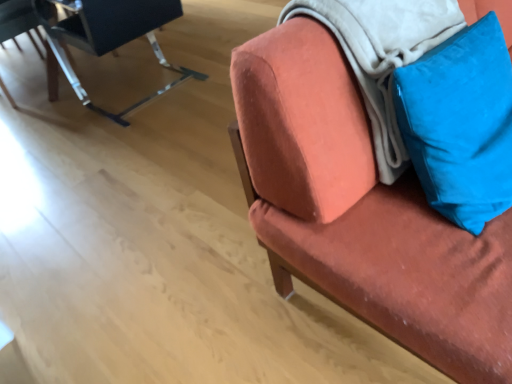
What do you see at coordinates (18, 21) in the screenshot? I see `metallic black chair at upper left, the 3th chair positioned from the right` at bounding box center [18, 21].

At what (x,y) coordinates should I click in order to perform the action: click on velvet orange chair at upper right, the 1th chair in the right-to-left sequence. Please return your answer as a coordinate pair (x, y). Looking at the image, I should click on (362, 211).

Which is behind, point (493, 50) or point (64, 39)?

The point (64, 39) is behind.

Is blue velvet pillow at upper right situated inside metallic black chair at upper left, which appears as the second chair when viewed from the right, or outside?

blue velvet pillow at upper right is not enclosed by metallic black chair at upper left, which appears as the second chair when viewed from the right.

Is blue velvet pillow at upper right not close to metallic black chair at upper left, which appears as the second chair when viewed from the right?

blue velvet pillow at upper right is far away from metallic black chair at upper left, which appears as the second chair when viewed from the right.

Consider the image. Is blue velvet pillow at upper right facing towards metallic black chair at upper left, which appears as the second chair when viewed from the right?

No, blue velvet pillow at upper right is not aimed at metallic black chair at upper left, which appears as the second chair when viewed from the right.

Between metallic black chair at upper left, the second chair from the left, and blue velvet pillow at upper right, which one appears on the right side from the viewer's perspective?

blue velvet pillow at upper right.

Between metallic black chair at upper left, the second chair from the left, and blue velvet pillow at upper right, which one has smaller width?

Thinner between the two is blue velvet pillow at upper right.

At what (x,y) coordinates should I click in order to perform the action: click on the 2nd chair positioned below the blue velvet pillow at upper right (from a real-world perspective). Please return your answer as a coordinate pair (x, y). The height and width of the screenshot is (384, 512). Looking at the image, I should click on (106, 38).

Does metallic black chair at upper left, the second chair from the left, touch blue velvet pillow at upper right?

No, metallic black chair at upper left, the second chair from the left, is not in contact with blue velvet pillow at upper right.

Are velvet orange chair at upper right, which is the 3th chair in left-to-right order, and metallic black chair at upper left, which appears as the second chair when viewed from the right, far apart?

Indeed, velvet orange chair at upper right, which is the 3th chair in left-to-right order, is not near metallic black chair at upper left, which appears as the second chair when viewed from the right.

Considering the positions of objects velvet orange chair at upper right, which is the 3th chair in left-to-right order, and metallic black chair at upper left, the second chair from the left, in the image provided, who is in front, velvet orange chair at upper right, which is the 3th chair in left-to-right order, or metallic black chair at upper left, the second chair from the left,?

velvet orange chair at upper right, which is the 3th chair in left-to-right order, is more forward.

How many degrees apart are the facing directions of velvet orange chair at upper right, which is the 3th chair in left-to-right order, and metallic black chair at upper left, the second chair from the left?

The angle between the facing direction of velvet orange chair at upper right, which is the 3th chair in left-to-right order, and the facing direction of metallic black chair at upper left, the second chair from the left, is 179 degrees.

Can you confirm if velvet orange chair at upper right, the 1th chair in the right-to-left sequence, is wider than metallic black chair at upper left, which appears as the second chair when viewed from the right?

Yes.

Considering the sizes of soft white blanket at upper right and metallic black chair at upper left, the 3th chair positioned from the right, in the image, is soft white blanket at upper right wider or thinner than metallic black chair at upper left, the 3th chair positioned from the right,?

soft white blanket at upper right is thinner than metallic black chair at upper left, the 3th chair positioned from the right.

Locate an element on the screen. blanket on the right of metallic black chair at upper left, marked as the 1th chair in a left-to-right arrangement is located at coordinates (383, 54).

From the image's perspective, which is above, soft white blanket at upper right or metallic black chair at upper left, the 3th chair positioned from the right?

metallic black chair at upper left, the 3th chair positioned from the right, from the image's perspective.

From a real-world perspective, is soft white blanket at upper right below metallic black chair at upper left, marked as the 1th chair in a left-to-right arrangement?

Actually, soft white blanket at upper right is physically above metallic black chair at upper left, marked as the 1th chair in a left-to-right arrangement, in the real world.

In the image, is metallic black chair at upper left, marked as the 1th chair in a left-to-right arrangement, positioned in front of or behind blue velvet pillow at upper right?

In the image, metallic black chair at upper left, marked as the 1th chair in a left-to-right arrangement, appears behind blue velvet pillow at upper right.

Where is `chair that is the 3rd object directly below the blue velvet pillow at upper right (from a real-world perspective)`? chair that is the 3rd object directly below the blue velvet pillow at upper right (from a real-world perspective) is located at coordinates (18, 21).

Considering the points (23, 29) and (448, 196), which point is behind, point (23, 29) or point (448, 196)?

The point (23, 29) is more distant.

Could you tell me if metallic black chair at upper left, the 3th chair positioned from the right, is facing blue velvet pillow at upper right?

No, metallic black chair at upper left, the 3th chair positioned from the right, is not oriented towards blue velvet pillow at upper right.

Which of these two, blue velvet pillow at upper right or velvet orange chair at upper right, which is the 3th chair in left-to-right order, is wider?

velvet orange chair at upper right, which is the 3th chair in left-to-right order, is wider.

Which object is more forward, blue velvet pillow at upper right or velvet orange chair at upper right, the 1th chair in the right-to-left sequence?

velvet orange chair at upper right, the 1th chair in the right-to-left sequence, is closer to the camera.

Would you say velvet orange chair at upper right, the 1th chair in the right-to-left sequence, is part of blue velvet pillow at upper right's contents?

No, velvet orange chair at upper right, the 1th chair in the right-to-left sequence, is not inside blue velvet pillow at upper right.

Looking at the image, does blue velvet pillow at upper right seem bigger or smaller compared to velvet orange chair at upper right, which is the 3th chair in left-to-right order?

blue velvet pillow at upper right is smaller than velvet orange chair at upper right, which is the 3th chair in left-to-right order.

In the scene shown: Is velvet orange chair at upper right, which is the 3th chair in left-to-right order, in front of metallic black chair at upper left, the 3th chair positioned from the right?

Yes, velvet orange chair at upper right, which is the 3th chair in left-to-right order, is in front of metallic black chair at upper left, the 3th chair positioned from the right.

Which is closer to the camera, (274, 237) or (16, 107)?

Point (274, 237) is closer to the camera than point (16, 107).

From a real-world perspective, who is located lower, velvet orange chair at upper right, which is the 3th chair in left-to-right order, or metallic black chair at upper left, the 3th chair positioned from the right?

metallic black chair at upper left, the 3th chair positioned from the right, is physically lower.

From the image's perspective, who appears lower, velvet orange chair at upper right, the 1th chair in the right-to-left sequence, or metallic black chair at upper left, the 3th chair positioned from the right?

velvet orange chair at upper right, the 1th chair in the right-to-left sequence, appears lower in the image.

Locate an element on the screen. pillow positioned vertically above the metallic black chair at upper left, the second chair from the left (from a real-world perspective) is located at coordinates (460, 123).

Find the location of a particular element. chair that is the 1st object to the left of the blue velvet pillow at upper right, starting at the anchor is located at coordinates (106, 38).

When comparing their distances from velvet orange chair at upper right, the 1th chair in the right-to-left sequence, does soft white blanket at upper right or blue velvet pillow at upper right seem further?

blue velvet pillow at upper right is further to velvet orange chair at upper right, the 1th chair in the right-to-left sequence.

Considering their positions, is blue velvet pillow at upper right positioned further to metallic black chair at upper left, which appears as the second chair when viewed from the right, than velvet orange chair at upper right, the 1th chair in the right-to-left sequence?

blue velvet pillow at upper right is further to metallic black chair at upper left, which appears as the second chair when viewed from the right.

Looking at the image, which one is located further to metallic black chair at upper left, the 3th chair positioned from the right, blue velvet pillow at upper right or soft white blanket at upper right?

blue velvet pillow at upper right is positioned further to the anchor metallic black chair at upper left, the 3th chair positioned from the right.

Looking at the image, which one is located closer to blue velvet pillow at upper right, soft white blanket at upper right or velvet orange chair at upper right, the 1th chair in the right-to-left sequence?

soft white blanket at upper right is closer to blue velvet pillow at upper right.

Which object lies further to the anchor point metallic black chair at upper left, marked as the 1th chair in a left-to-right arrangement, velvet orange chair at upper right, the 1th chair in the right-to-left sequence, or soft white blanket at upper right?

Based on the image, velvet orange chair at upper right, the 1th chair in the right-to-left sequence, appears to be further to metallic black chair at upper left, marked as the 1th chair in a left-to-right arrangement.

Considering their positions, is blue velvet pillow at upper right positioned further to metallic black chair at upper left, marked as the 1th chair in a left-to-right arrangement, than velvet orange chair at upper right, which is the 3th chair in left-to-right order?

blue velvet pillow at upper right is further to metallic black chair at upper left, marked as the 1th chair in a left-to-right arrangement.

Looking at the image, which one is located further to velvet orange chair at upper right, the 1th chair in the right-to-left sequence, metallic black chair at upper left, the second chair from the left, or blue velvet pillow at upper right?

metallic black chair at upper left, the second chair from the left, is positioned further to the anchor velvet orange chair at upper right, the 1th chair in the right-to-left sequence.

Which object lies further to the anchor point soft white blanket at upper right, velvet orange chair at upper right, which is the 3th chair in left-to-right order, or blue velvet pillow at upper right?

The object further to soft white blanket at upper right is velvet orange chair at upper right, which is the 3th chair in left-to-right order.

Locate an element on the screen. This screenshot has width=512, height=384. blanket between metallic black chair at upper left, the 3th chair positioned from the right, and velvet orange chair at upper right, which is the 3th chair in left-to-right order, from left to right is located at coordinates (383, 54).

You are a GUI agent. You are given a task and a screenshot of the screen. Output one action in this format:
    pyautogui.click(x=<x>, y=<y>)
    Task: Click on the pillow between metallic black chair at upper left, the 3th chair positioned from the right, and velvet orange chair at upper right, which is the 3th chair in left-to-right order, in the horizontal direction
    Image resolution: width=512 pixels, height=384 pixels.
    Given the screenshot: What is the action you would take?
    pyautogui.click(x=460, y=123)

This screenshot has height=384, width=512. Identify the location of pillow located between soft white blanket at upper right and velvet orange chair at upper right, the 1th chair in the right-to-left sequence, in the left-right direction. click(x=460, y=123).

Find the location of a particular element. Image resolution: width=512 pixels, height=384 pixels. blanket between metallic black chair at upper left, the second chair from the left, and blue velvet pillow at upper right from left to right is located at coordinates (383, 54).